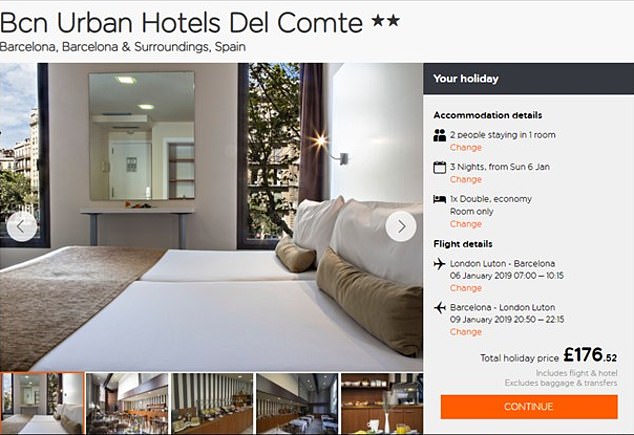
Identify the location of narrow brown pillows. This screenshot has height=435, width=634. (366, 303), (283, 249).